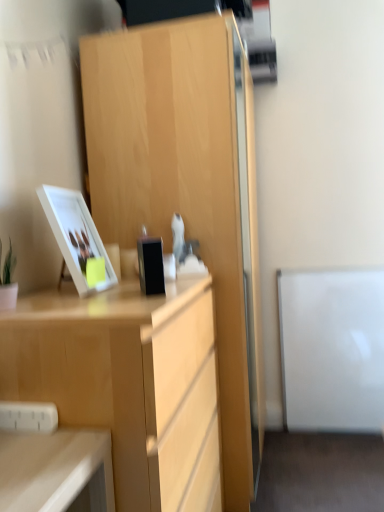
Describe the element at coordinates (127, 383) in the screenshot. I see `light wood desk at center` at that location.

This screenshot has width=384, height=512. Describe the element at coordinates (151, 266) in the screenshot. I see `black glossy phone at center` at that location.

Find the location of `light wood desk at center`. light wood desk at center is located at coordinates (127, 383).

What are the coordinates of `cabinetry that is above the light wood desk at center (from the image's perspective)` in the screenshot? It's located at (187, 190).

Which is farther, (173, 68) or (158, 467)?

Result: Point (173, 68)

Is light wood cabinet at center bigger or smaller than light wood desk at center?

In the image, light wood cabinet at center appears to be larger than light wood desk at center.

From the picture: From the image's perspective, which one is positioned higher, light wood cabinet at center or black glossy phone at center?

black glossy phone at center, from the image's perspective.

Is light wood cabinet at center directly adjacent to black glossy phone at center?

There is a gap between light wood cabinet at center and black glossy phone at center.

From their relative heights in the image, would you say light wood cabinet at center is taller or shorter than black glossy phone at center?

Considering their sizes, light wood cabinet at center has more height than black glossy phone at center.

At what (x,y) coordinates should I click in order to perform the action: click on appliance in front of the light wood cabinet at center. Please return your answer as a coordinate pair (x, y). Looking at the image, I should click on click(151, 266).

From the image's perspective, is light wood desk at center on light wood cabinet at center?

No, from the image's perspective, light wood desk at center is not above light wood cabinet at center.

Looking at this image, is light wood desk at center spatially inside light wood cabinet at center, or outside of it?

light wood desk at center is outside light wood cabinet at center.

Considering the sizes of objects light wood desk at center and light wood cabinet at center in the image provided, who is shorter, light wood desk at center or light wood cabinet at center?

light wood desk at center.

Is light wood cabinet at center at the back of light wood desk at center?

No.

Identify the location of picture frame above the black glossy phone at center (from a real-world perspective). The image size is (384, 512). (76, 236).

Is white glossy picture frame at upper left smaller than black glossy phone at center?

Incorrect, white glossy picture frame at upper left is not smaller in size than black glossy phone at center.

From the image's perspective, is white glossy picture frame at upper left beneath black glossy phone at center?

No.

Is white glossy picture frame at upper left inside the boundaries of black glossy phone at center, or outside?

white glossy picture frame at upper left is outside black glossy phone at center.

In the scene shown: Considering the sizes of objects black glossy phone at center and light wood desk at center in the image provided, who is smaller, black glossy phone at center or light wood desk at center?

black glossy phone at center.

What's the angular difference between black glossy phone at center and light wood desk at center's facing directions?

22.9 degrees separate the facing orientations of black glossy phone at center and light wood desk at center.

Is black glossy phone at center surrounding light wood desk at center?

No, light wood desk at center is not inside black glossy phone at center.

From the image's perspective, does black glossy phone at center appear lower than white glossy picture frame at upper left?

Yes.

Based on the photo, from a real-world perspective, which is physically above, black glossy phone at center or white glossy picture frame at upper left?

white glossy picture frame at upper left is physically above.

How many degrees apart are the facing directions of black glossy phone at center and white glossy picture frame at upper left?

There is a 20-degree angle between the facing directions of black glossy phone at center and white glossy picture frame at upper left.

From a real-world perspective, between black glossy phone at center and light wood cabinet at center, who is vertically lower?

light wood cabinet at center, from a real-world perspective.

What's the angular difference between black glossy phone at center and light wood cabinet at center's facing directions?

24.1 degrees.

From the image's perspective, is black glossy phone at center beneath light wood cabinet at center?

Incorrect, from the image's perspective, black glossy phone at center is higher than light wood cabinet at center.

Is black glossy phone at center oriented away from light wood cabinet at center?

No, black glossy phone at center is not facing the opposite direction of light wood cabinet at center.

The height and width of the screenshot is (512, 384). In order to click on desk below the light wood cabinet at center (from a real-world perspective) in this screenshot , I will do `click(127, 383)`.

Image resolution: width=384 pixels, height=512 pixels. In order to click on cabinetry that appears on the right of black glossy phone at center in this screenshot , I will do `click(187, 190)`.

From the image, which object appears to be farther from light wood desk at center, black glossy phone at center or light wood cabinet at center?

light wood cabinet at center lies further to light wood desk at center than the other object.

Looking at the image, which one is located further to white glossy picture frame at upper left, light wood desk at center or light wood cabinet at center?

light wood cabinet at center is further to white glossy picture frame at upper left.

From the image, which object appears to be farther from white glossy picture frame at upper left, light wood desk at center or black glossy phone at center?

Based on the image, light wood desk at center appears to be further to white glossy picture frame at upper left.

Looking at the image, which one is located further to black glossy phone at center, light wood desk at center or white glossy picture frame at upper left?

light wood desk at center lies further to black glossy phone at center than the other object.

When comparing their distances from black glossy phone at center, does white glossy picture frame at upper left or light wood desk at center seem further?

light wood desk at center is positioned further to the anchor black glossy phone at center.

From the image, which object appears to be nearer to black glossy phone at center, light wood cabinet at center or white glossy picture frame at upper left?

Among the two, white glossy picture frame at upper left is located nearer to black glossy phone at center.

When comparing their distances from white glossy picture frame at upper left, does light wood cabinet at center or black glossy phone at center seem further?

Based on the image, light wood cabinet at center appears to be further to white glossy picture frame at upper left.

Looking at this image, when comparing their distances from light wood desk at center, does white glossy picture frame at upper left or black glossy phone at center seem further?

white glossy picture frame at upper left lies further to light wood desk at center than the other object.

You are a GUI agent. You are given a task and a screenshot of the screen. Output one action in this format:
    pyautogui.click(x=<x>, y=<y>)
    Task: Click on the appliance located between light wood desk at center and light wood cabinet at center in the depth direction
    This screenshot has width=384, height=512.
    Given the screenshot: What is the action you would take?
    pyautogui.click(x=151, y=266)

This screenshot has height=512, width=384. In order to click on appliance between white glossy picture frame at upper left and light wood desk at center from top to bottom in this screenshot , I will do `click(151, 266)`.

The width and height of the screenshot is (384, 512). Find the location of `picture frame between light wood desk at center and light wood cabinet at center from front to back`. picture frame between light wood desk at center and light wood cabinet at center from front to back is located at coordinates (76, 236).

This screenshot has height=512, width=384. Find the location of `picture frame between black glossy phone at center and light wood cabinet at center along the z-axis`. picture frame between black glossy phone at center and light wood cabinet at center along the z-axis is located at coordinates (76, 236).